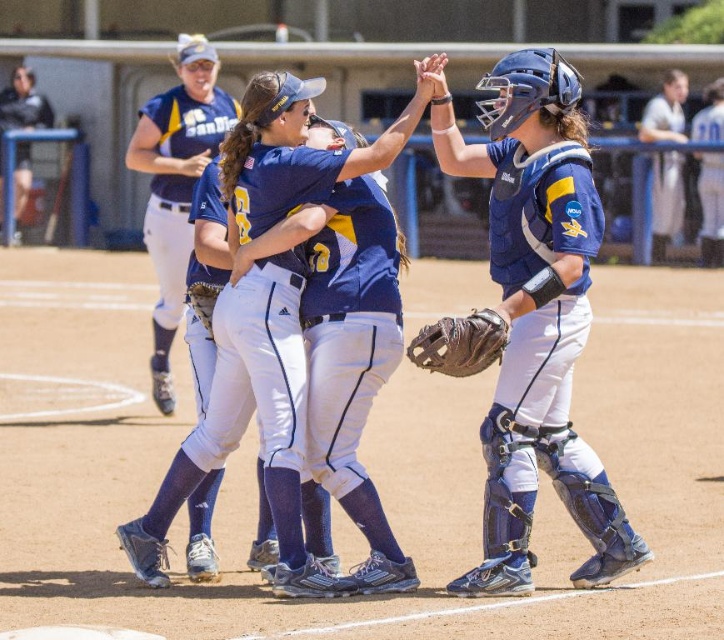
Question: Does blue matte catcher at center appear under brown leather glove at lower center?

Choices:
 (A) yes
 (B) no

Answer: (B)

Question: Is matte blue jersey at center positioned in front of brown leather glove at lower center?

Choices:
 (A) yes
 (B) no

Answer: (B)

Question: Which object is positioned closest to the brown leather glove at lower center?

Choices:
 (A) blue matte catcher at center
 (B) matte blue jersey at center

Answer: (A)

Question: Which of the following is the closest to the observer?

Choices:
 (A) blue matte catcher at center
 (B) matte blue jersey at center

Answer: (A)

Question: Which of the following is the farthest from the observer?

Choices:
 (A) blue matte catcher at center
 (B) brown leather glove at lower center
 (C) matte blue jersey at center

Answer: (C)

Question: Can you confirm if blue matte catcher at center is positioned below brown leather glove at lower center?

Choices:
 (A) yes
 (B) no

Answer: (B)